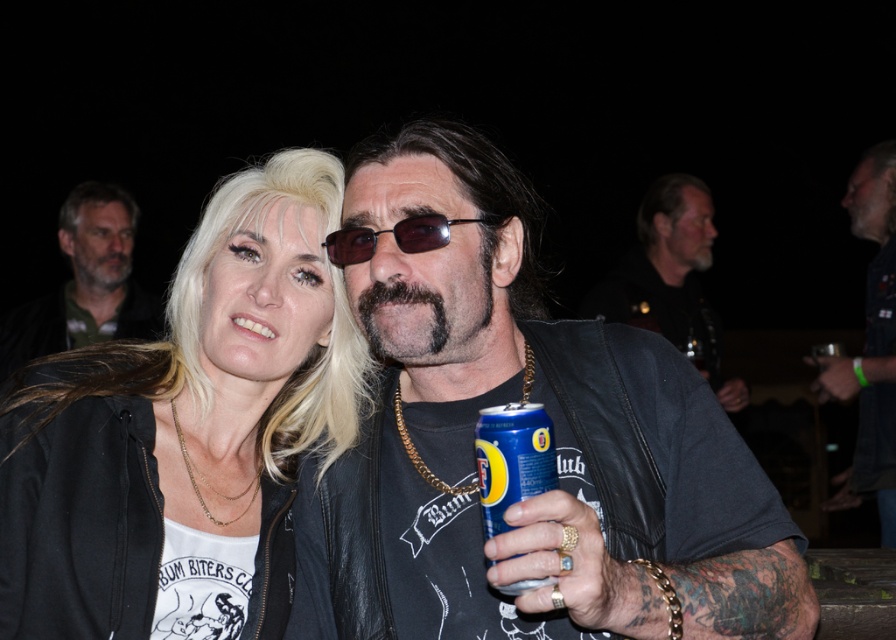
You are standing in the crowd at the event and want to locate the dark brown leather jacket at upper left. Where should you look relative to the center of the image?

The dark brown leather jacket at upper left is located at point 0.444 on the x axis and 0.096 on the y axis, so you should look slightly to the left and a bit above the center of the image.

You are at the event and want to grab the blue metallic can at center. Based on its coordinates, where exactly should you look to find it?

The blue metallic can at center is located at coordinates point (513,460).